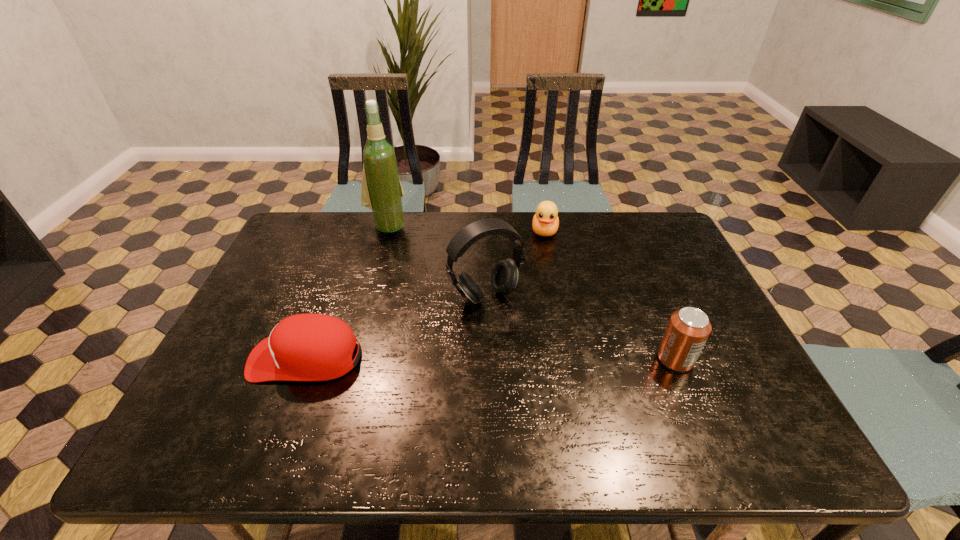
Locate an element on the screen. This screenshot has height=540, width=960. baseball cap is located at coordinates (305, 347).

Locate an element on the screen. The height and width of the screenshot is (540, 960). can is located at coordinates (688, 329).

This screenshot has height=540, width=960. Find the location of `the rightmost object`. the rightmost object is located at coordinates (688, 329).

At what (x,y) coordinates should I click in order to perform the action: click on the tallest object. Please return your answer as a coordinate pair (x, y). The width and height of the screenshot is (960, 540). Looking at the image, I should click on (381, 190).

Identify the location of earphone. The width and height of the screenshot is (960, 540). (504, 277).

Where is `the third farthest object`? This screenshot has width=960, height=540. the third farthest object is located at coordinates (504, 277).

Where is `the fourth object from left to right`? the fourth object from left to right is located at coordinates tap(545, 222).

At what (x,y) coordinates should I click in order to perform the action: click on free space located on the back of the can. Please return your answer as a coordinate pair (x, y). This screenshot has width=960, height=540. Looking at the image, I should click on (636, 266).

At what (x,y) coordinates should I click in order to perform the action: click on free space located 0.380m on the front-facing side of the wine bottle. Please return your answer as a coordinate pair (x, y). The height and width of the screenshot is (540, 960). Looking at the image, I should click on (428, 314).

Where is `free spot located 0.210m on the front-facing side of the wine bottle`? The image size is (960, 540). free spot located 0.210m on the front-facing side of the wine bottle is located at coordinates (410, 275).